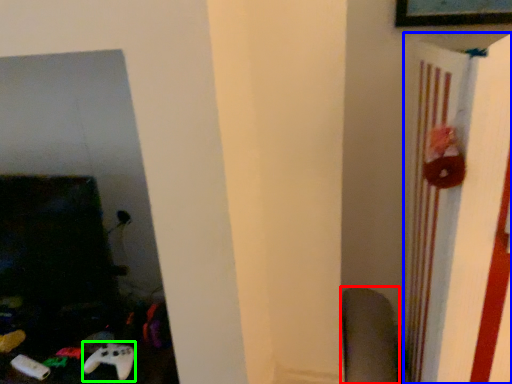
Question: Which object is positioned farthest from swivel chair (highlighted by a red box)? Select from bulletin board (highlighted by a blue box) and game controller (highlighted by a green box).

Choices:
 (A) bulletin board
 (B) game controller

Answer: (B)